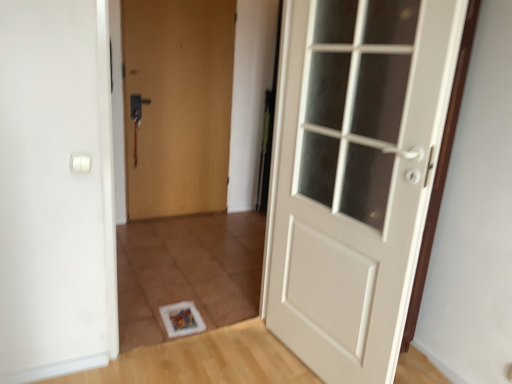
Locate an element on the screen. This screenshot has height=384, width=512. free space in front of matte wood door at center, arranged as the 1th door when viewed from the left is located at coordinates (173, 236).